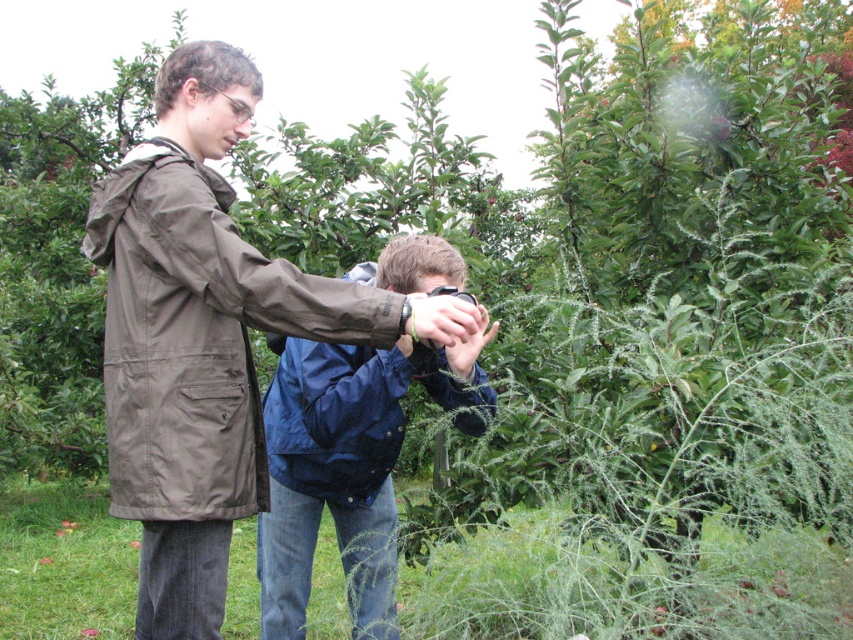
You are standing in a garden and see the matte brown jacket at center and the blue fabric camera at center. Which object is closer to your left side?

The matte brown jacket at center is to the left of the blue fabric camera at center, so it is closer to your left side.

You are standing in the garden and want to take a photo that includes both the point at coordinates (107, 349) and the point at (433, 280). Which point should you focus on first to ensure both are in sharp focus?

You should focus on point (107, 349) first because it is closer to the camera than point (433, 280). This ensures the closer point is in focus, and the farther point will also be within the depth of field if the focus is set correctly.

You are standing in the garden and see the point at coordinates (x=206, y=337). Which object is this point located on?

The point at coordinates (x=206, y=337) is located on the matte brown jacket at center.